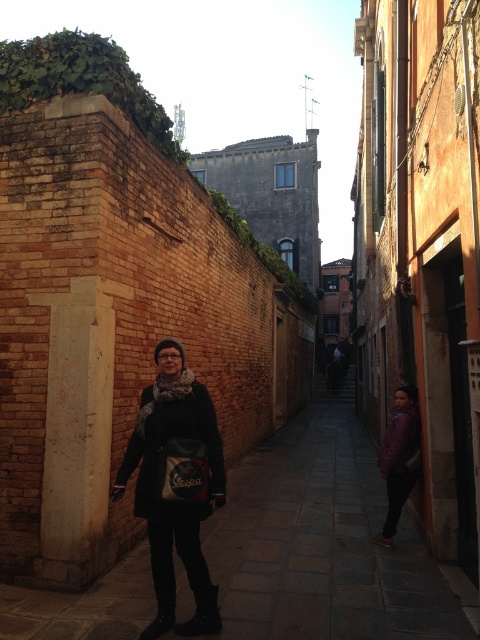
You are standing in the narrow alleyway of an old European city. You see a point marked at coordinates (322,541). What is located at that point?

The point at coordinates (322,541) indicates dark stone pavement at center.

You are a tailor who needs to determine which clothing item requires more fabric to make between the matte black coat at center and the purple matte jacket at lower right. Which one would need more fabric?

The matte black coat at center requires more fabric because it is bigger than the purple matte jacket at lower right.

You are navigating a tight alleyway in an old European city. You see two points marked in the scene. The first point is at coordinate point (x=9, y=628) and the second is at point (x=139, y=476). Which point is closer to you as you stand at the entrance of the alley?

Point (x=9, y=628) is in front of point (x=139, y=476), so it is closer to you as you stand at the entrance of the alley.